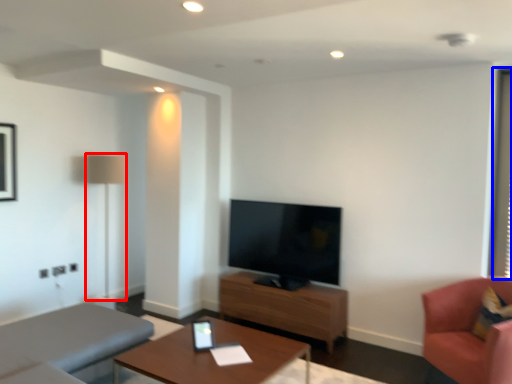
Question: Among these objects, which one is farthest to the camera, lamp (highlighted by a red box) or window screen (highlighted by a blue box)?

Choices:
 (A) lamp
 (B) window screen

Answer: (A)